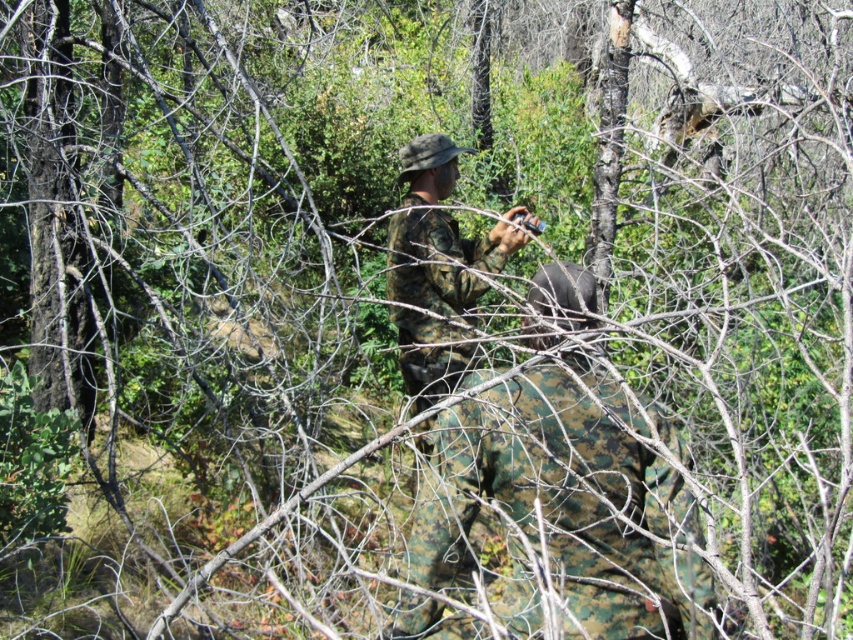
You are a hiker trying to locate a person in the forest. According to the image, where is the camo fabric uniform located in relation to the point marked at coordinates (x=563, y=502)?

The camo fabric uniform at center is located exactly at the point marked at coordinates (x=563, y=502).

You are a hiker trying to spot the camo fabric uniform at center and the camouflage fabric uniform at center in the forest. Which one is smaller in size?

The camo fabric uniform at center is smaller in size than the camouflage fabric uniform at center because it occupies less space.